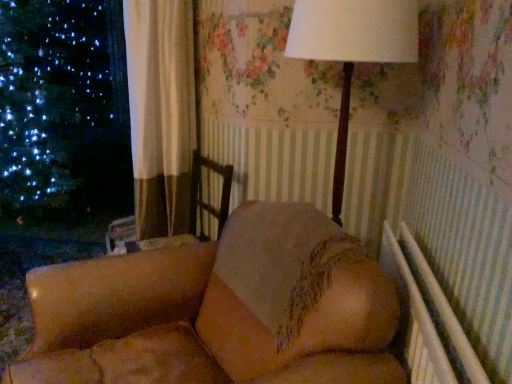
In order to face matte brown lamp at upper center, should I rotate leftwards or rightwards?

It's best to rotate right around 10.924 degrees.

Where is `matte brown lamp at upper center`? This screenshot has height=384, width=512. matte brown lamp at upper center is located at coordinates (352, 50).

What do you see at coordinates (352, 50) in the screenshot?
I see `matte brown lamp at upper center` at bounding box center [352, 50].

This screenshot has width=512, height=384. What do you see at coordinates (219, 310) in the screenshot?
I see `velvet beige sofa at center` at bounding box center [219, 310].

Locate an element on the screen. The image size is (512, 384). velvet beige sofa at center is located at coordinates (219, 310).

The image size is (512, 384). I want to click on matte brown lamp at upper center, so click(352, 50).

Considering the relative positions of velvet beige sofa at center and matte brown lamp at upper center in the image provided, is velvet beige sofa at center to the left or to the right of matte brown lamp at upper center?

Based on their positions, velvet beige sofa at center is located to the left of matte brown lamp at upper center.

Which is in front, velvet beige sofa at center or matte brown lamp at upper center?

Positioned in front is velvet beige sofa at center.

Which point is more forward, (106, 276) or (342, 185)?

The point (106, 276) is closer to the camera.

From the image's perspective, does velvet beige sofa at center appear lower than matte brown lamp at upper center?

Yes.

From a real-world perspective, relative to matte brown lamp at upper center, is velvet beige sofa at center vertically above or below?

velvet beige sofa at center is situated lower than matte brown lamp at upper center in the real world.

Does velvet beige sofa at center have a lesser width compared to matte brown lamp at upper center?

No, velvet beige sofa at center is not thinner than matte brown lamp at upper center.

Looking at this image, is velvet beige sofa at center taller than matte brown lamp at upper center?

No, velvet beige sofa at center is not taller than matte brown lamp at upper center.

Is velvet beige sofa at center smaller than matte brown lamp at upper center?

No, velvet beige sofa at center is not smaller than matte brown lamp at upper center.

Is velvet beige sofa at center spatially inside matte brown lamp at upper center, or outside of it?

The correct answer is: outside.

Is velvet beige sofa at center far from matte brown lamp at upper center?

No, there isn't a large distance between velvet beige sofa at center and matte brown lamp at upper center.

Is matte brown lamp at upper center at the back of velvet beige sofa at center?

velvet beige sofa at center does not have its back to matte brown lamp at upper center.

How different are the orientations of velvet beige sofa at center and matte brown lamp at upper center in degrees?

velvet beige sofa at center and matte brown lamp at upper center are facing 4.14 degrees away from each other.

I want to click on furniture that is on the left side of matte brown lamp at upper center, so click(x=219, y=310).

Based on the photo, which object is positioned more to the right, matte brown lamp at upper center or velvet beige sofa at center?

matte brown lamp at upper center.

Is matte brown lamp at upper center in front of velvet beige sofa at center?

No, matte brown lamp at upper center is further to the viewer.

Which is behind, point (332, 211) or point (27, 354)?

The point (332, 211) is farther from the camera.

From the image's perspective, is matte brown lamp at upper center beneath velvet beige sofa at center?

Incorrect, from the image's perspective, matte brown lamp at upper center is higher than velvet beige sofa at center.

From a real-world perspective, which is physically above, matte brown lamp at upper center or velvet beige sofa at center?

matte brown lamp at upper center is physically above.

Is matte brown lamp at upper center wider than velvet beige sofa at center?

Incorrect, the width of matte brown lamp at upper center does not surpass that of velvet beige sofa at center.

Based on the photo, who is shorter, matte brown lamp at upper center or velvet beige sofa at center?

Standing shorter between the two is velvet beige sofa at center.

Which of these two, matte brown lamp at upper center or velvet beige sofa at center, is bigger?

velvet beige sofa at center.

Is matte brown lamp at upper center located outside velvet beige sofa at center?

Yes, matte brown lamp at upper center is located beyond the bounds of velvet beige sofa at center.

Is matte brown lamp at upper center far from velvet beige sofa at center?

No, there isn't a large distance between matte brown lamp at upper center and velvet beige sofa at center.

Does matte brown lamp at upper center turn towards velvet beige sofa at center?

Yes, matte brown lamp at upper center is facing velvet beige sofa at center.

Can you tell me how much matte brown lamp at upper center and velvet beige sofa at center differ in facing direction?

The angular difference between matte brown lamp at upper center and velvet beige sofa at center is 4.14 degrees.

Identify the location of lamp above the velvet beige sofa at center (from a real-world perspective). (352, 50).

This screenshot has width=512, height=384. There is a velvet beige sofa at center. Identify the location of lamp above it (from a real-world perspective). (352, 50).

Identify the location of lamp on the right of the velvet beige sofa at center. (352, 50).